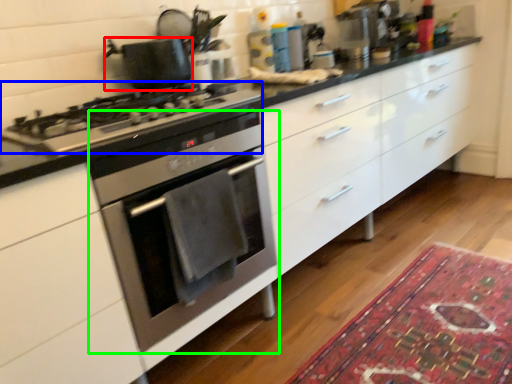
Question: Estimate the real-world distances between objects in this image. Which object is farther from kitchen appliance (highlighted by a red box), gas stove (highlighted by a blue box) or oven (highlighted by a green box)?

Choices:
 (A) gas stove
 (B) oven

Answer: (B)